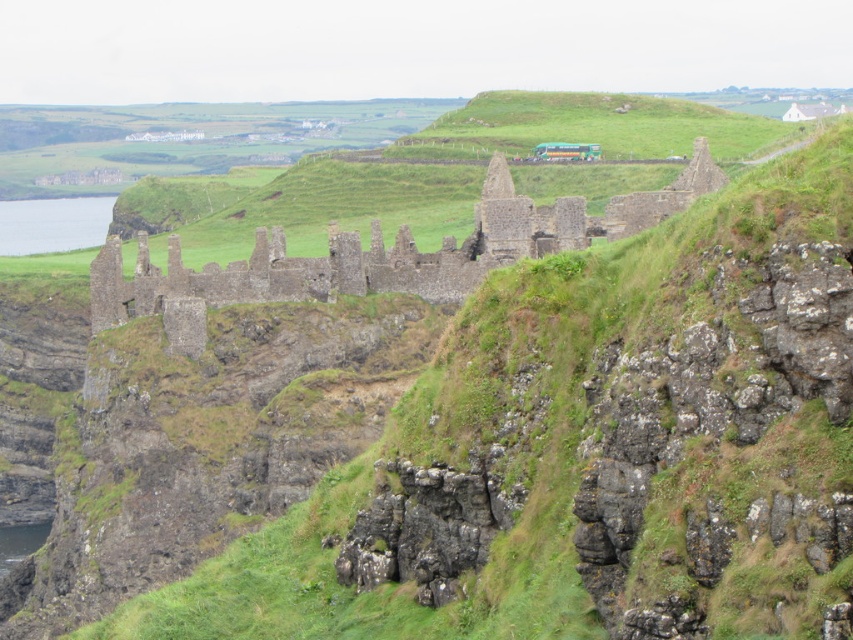
Between rustic stone ruins at center and clear blue water at left, which one has more height?

clear blue water at left

Is point (566, 234) in front of point (7, 216)?

Yes.

Describe the element at coordinates (378, 256) in the screenshot. I see `rustic stone ruins at center` at that location.

Locate an element on the screen. rustic stone ruins at center is located at coordinates (378, 256).